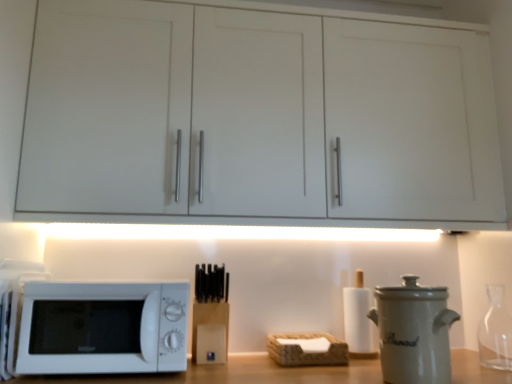
Question: Can you confirm if brown woven basket at center is positioned to the left of white ceramic bread bin at right?

Choices:
 (A) no
 (B) yes

Answer: (B)

Question: From the image's perspective, is brown woven basket at center on white ceramic bread bin at right?

Choices:
 (A) yes
 (B) no

Answer: (B)

Question: Is the position of brown woven basket at center more distant than that of white ceramic bread bin at right?

Choices:
 (A) no
 (B) yes

Answer: (B)

Question: Is brown woven basket at center looking in the opposite direction of white ceramic bread bin at right?

Choices:
 (A) no
 (B) yes

Answer: (A)

Question: Can you confirm if brown woven basket at center is positioned to the right of white ceramic bread bin at right?

Choices:
 (A) yes
 (B) no

Answer: (B)

Question: Considering their positions, is white ceramic bread bin at right located in front of or behind white matte microwave at lower left?

Choices:
 (A) front
 (B) behind

Answer: (A)

Question: From the image's perspective, relative to white matte microwave at lower left, is white ceramic bread bin at right above or below?

Choices:
 (A) below
 (B) above

Answer: (B)

Question: From a real-world perspective, is white ceramic bread bin at right above or below white matte microwave at lower left?

Choices:
 (A) below
 (B) above

Answer: (B)

Question: Visually, is white ceramic bread bin at right positioned to the left or to the right of white matte microwave at lower left?

Choices:
 (A) right
 (B) left

Answer: (A)

Question: Visually, is white ceramic bread bin at right positioned to the left or to the right of white matte cabinet at upper center?

Choices:
 (A) left
 (B) right

Answer: (B)

Question: From a real-world perspective, is white ceramic bread bin at right above or below white matte cabinet at upper center?

Choices:
 (A) above
 (B) below

Answer: (B)

Question: Is point (418, 347) closer or farther from the camera than point (27, 69)?

Choices:
 (A) closer
 (B) farther

Answer: (A)

Question: Based on their sizes in the image, would you say white ceramic bread bin at right is bigger or smaller than white matte cabinet at upper center?

Choices:
 (A) small
 (B) big

Answer: (A)

Question: From the image's perspective, is white ceramic bread bin at right positioned above or below white matte paper towel at center-right, the second bottle in the front-to-back sequence?

Choices:
 (A) above
 (B) below

Answer: (A)

Question: In the image, is white ceramic bread bin at right positioned in front of or behind white matte paper towel at center-right, the second bottle in the front-to-back sequence?

Choices:
 (A) front
 (B) behind

Answer: (A)